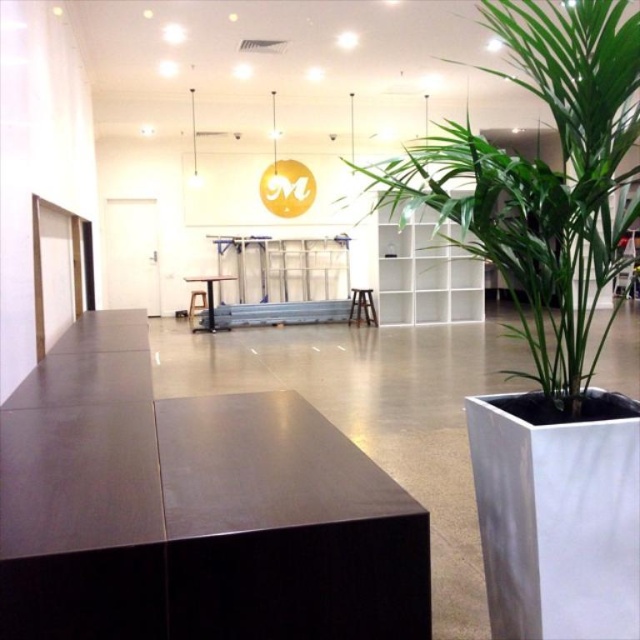
Question: Can you confirm if green leafy plant at right is bigger than matte black table at center?

Choices:
 (A) yes
 (B) no

Answer: (A)

Question: Does green leafy plant at right appear on the right side of matte black table at center?

Choices:
 (A) no
 (B) yes

Answer: (B)

Question: Is green leafy plant at right to the left of matte black table at center from the viewer's perspective?

Choices:
 (A) yes
 (B) no

Answer: (B)